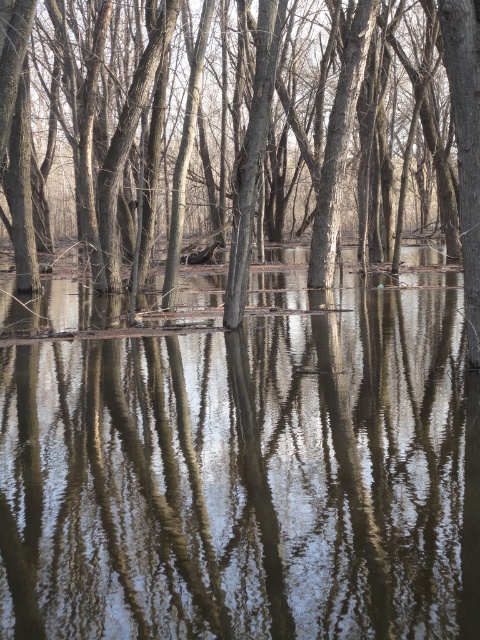
Based on the photo, is clear water at center to the left of smooth bark tree at center from the viewer's perspective?

Incorrect, clear water at center is not on the left side of smooth bark tree at center.

Between clear water at center and smooth bark tree at center, which one appears on the right side from the viewer's perspective?

Positioned to the right is clear water at center.

Who is more distant from viewer, [409,483] or [414,64]?

The point [414,64] is behind.

Find the location of a particular element. The height and width of the screenshot is (640, 480). clear water at center is located at coordinates (249, 474).